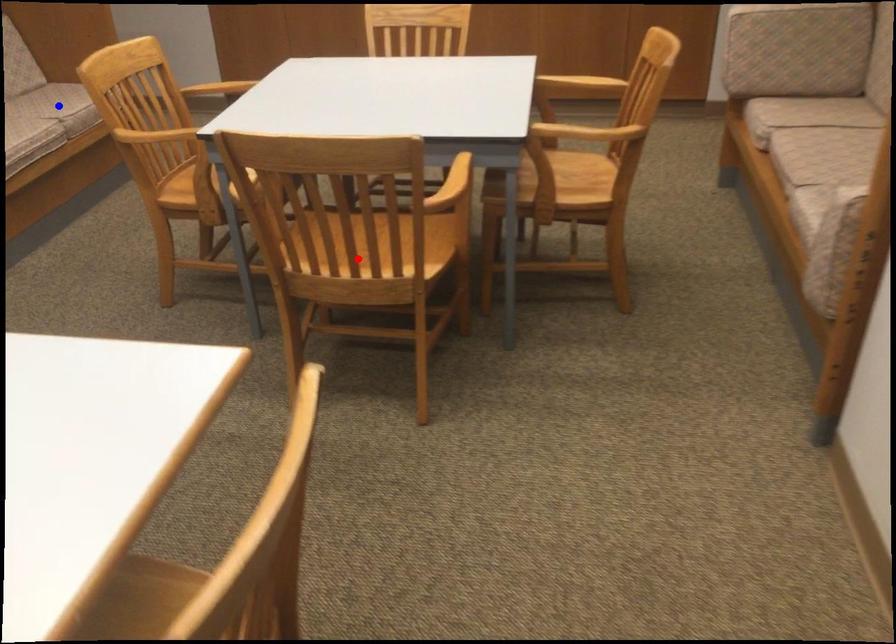
Question: Two points are marked on the image. Which point is closer to the camera?

Choices:
 (A) Blue point is closer.
 (B) Red point is closer.

Answer: (B)